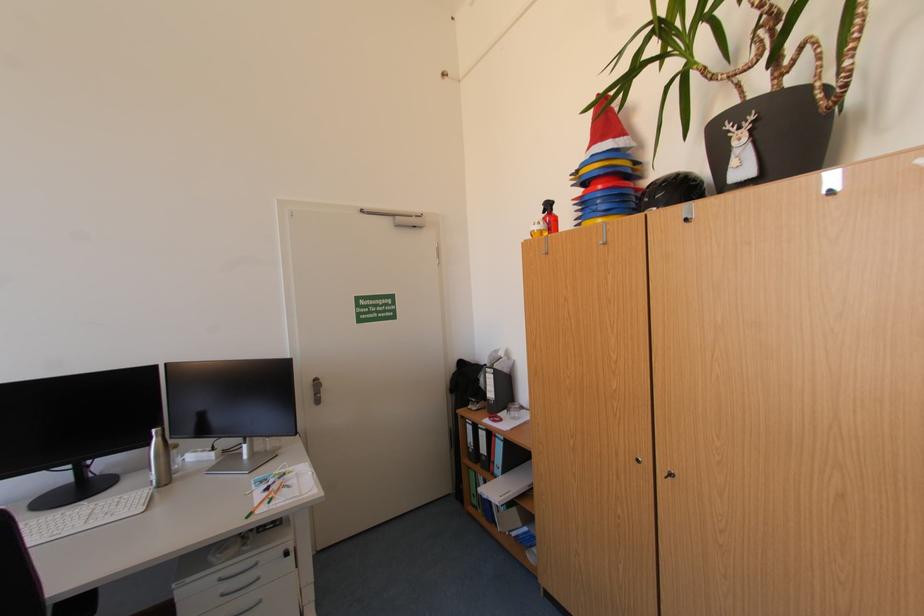
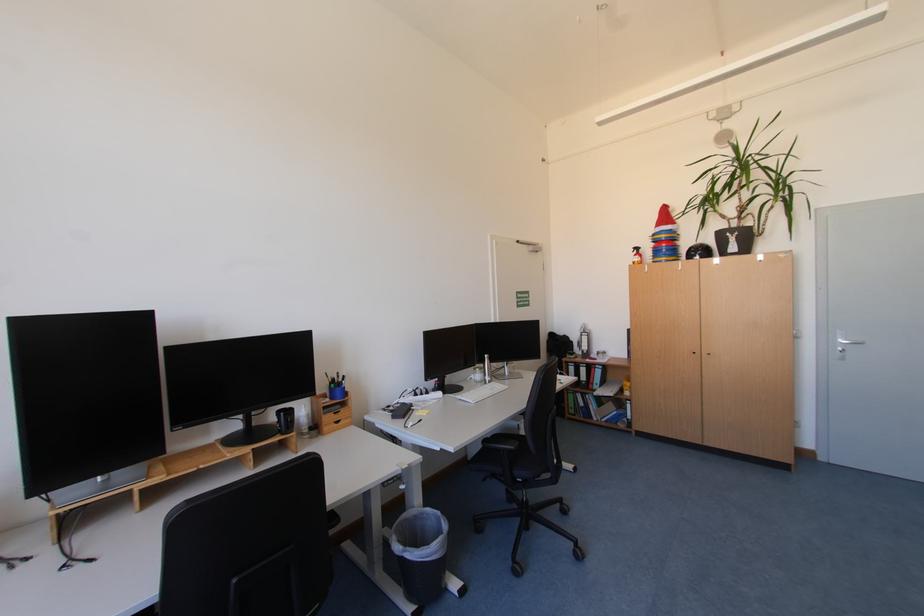
The point at (490, 436) is marked in the first image. Where is the corresponding point in the second image?

(590, 371)